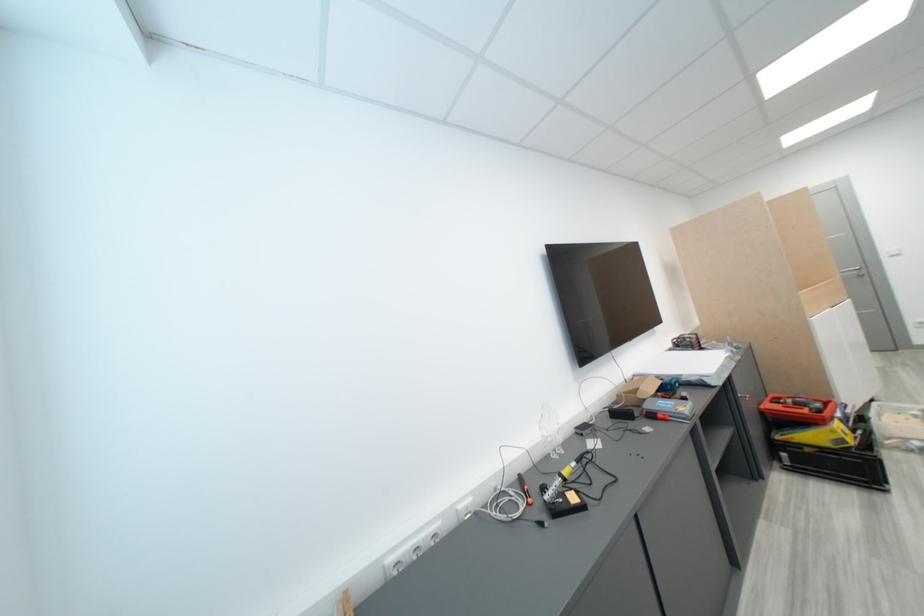
Find where to grasp the orange power drill. Please return your answer as a coordinate pair (x, y).

(797, 408)